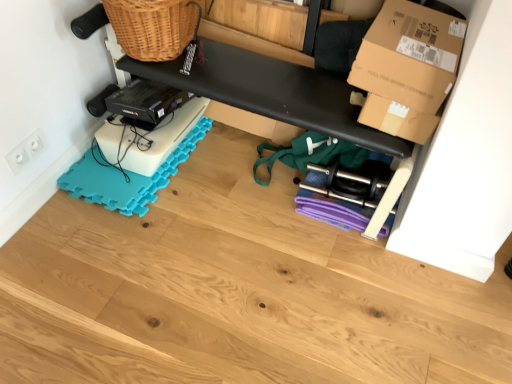
Question: Is black matte bench at upper center outside white plastic electrical outlet at lower left?

Choices:
 (A) no
 (B) yes

Answer: (B)

Question: Is black matte bench at upper center taller than white plastic electrical outlet at lower left?

Choices:
 (A) no
 (B) yes

Answer: (B)

Question: Would you say black matte bench at upper center is a long distance from white plastic electrical outlet at lower left?

Choices:
 (A) no
 (B) yes

Answer: (A)

Question: From a real-world perspective, is black matte bench at upper center on white plastic electrical outlet at lower left?

Choices:
 (A) yes
 (B) no

Answer: (A)

Question: Does black matte bench at upper center come behind white plastic electrical outlet at lower left?

Choices:
 (A) no
 (B) yes

Answer: (B)

Question: Is black matte bench at upper center thinner than white plastic electrical outlet at lower left?

Choices:
 (A) yes
 (B) no

Answer: (B)

Question: Can you confirm if white plastic electrical outlet at lower left is bigger than black matte bench at upper center?

Choices:
 (A) no
 (B) yes

Answer: (A)

Question: Is white plastic electrical outlet at lower left surrounding black matte bench at upper center?

Choices:
 (A) yes
 (B) no

Answer: (B)

Question: From a real-world perspective, is white plastic electrical outlet at lower left located higher than black matte bench at upper center?

Choices:
 (A) yes
 (B) no

Answer: (B)

Question: Is white plastic electrical outlet at lower left shorter than black matte bench at upper center?

Choices:
 (A) yes
 (B) no

Answer: (A)

Question: Does white plastic electrical outlet at lower left have a greater width compared to black matte bench at upper center?

Choices:
 (A) no
 (B) yes

Answer: (A)

Question: Is white plastic electrical outlet at lower left not within black matte bench at upper center?

Choices:
 (A) yes
 (B) no

Answer: (A)

Question: Is wooden floor at lower center closer to camera compared to black matte bench at upper center?

Choices:
 (A) yes
 (B) no

Answer: (A)